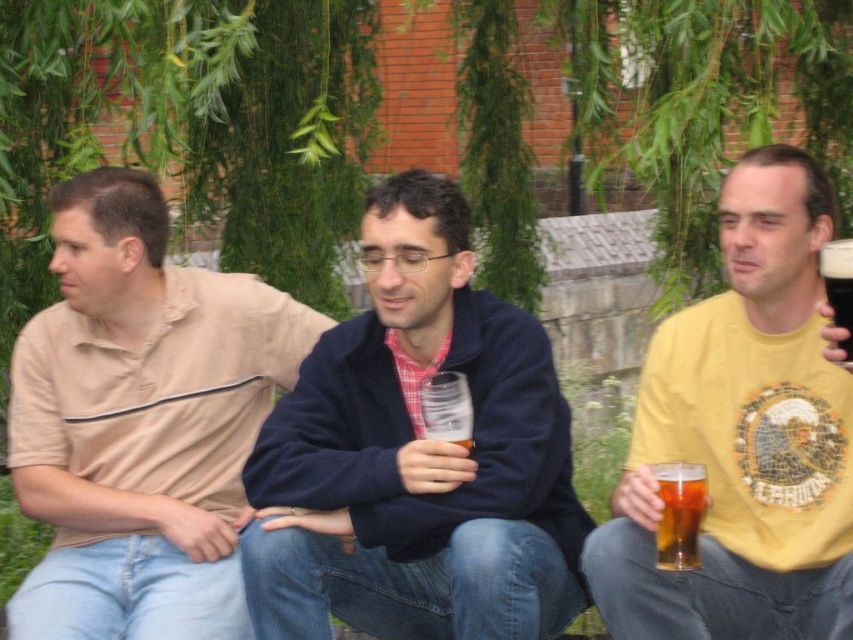
Can you confirm if matte blue jacket at center is bigger than yellow printed t-shirt at right?

Yes, matte blue jacket at center is bigger than yellow printed t-shirt at right.

Which of these two, matte blue jacket at center or yellow printed t-shirt at right, stands taller?

matte blue jacket at center is taller.

You are a GUI agent. You are given a task and a screenshot of the screen. Output one action in this format:
    pyautogui.click(x=<x>, y=<y>)
    Task: Click on the matte blue jacket at center
    Image resolution: width=853 pixels, height=640 pixels.
    Given the screenshot: What is the action you would take?
    pyautogui.click(x=416, y=456)

Between yellow printed t-shirt at right and dark brown glass at right, which one is positioned higher?

Positioned higher is dark brown glass at right.

Which is in front, point (775, 253) or point (831, 244)?

Point (831, 244) is in front.

At what (x,y) coordinates should I click in order to perform the action: click on yellow printed t-shirt at right. Please return your answer as a coordinate pair (x, y). Image resolution: width=853 pixels, height=640 pixels. Looking at the image, I should click on (743, 435).

Is point (73, 616) farther from camera compared to point (846, 360)?

Yes, it is behind point (846, 360).

Is beige cotton polo shirt at left above dark brown glass at right?

No, beige cotton polo shirt at left is not above dark brown glass at right.

I want to click on beige cotton polo shirt at left, so click(x=140, y=420).